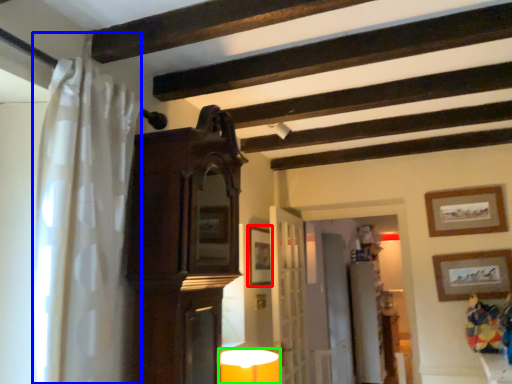
Question: Which object is positioned closest to picture frame (highlighted by a red box)? Select from shower curtain (highlighted by a blue box) and table lamp (highlighted by a green box).

Choices:
 (A) shower curtain
 (B) table lamp

Answer: (B)